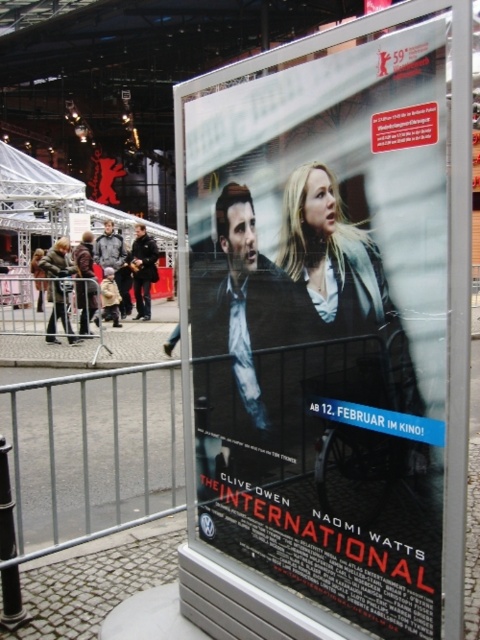
Is matte black suit at center wider than dark gray jacket at center?

No.

Is matte black suit at center to the right of dark gray jacket at center from the viewer's perspective?

Correct, you'll find matte black suit at center to the right of dark gray jacket at center.

I want to click on matte black suit at center, so click(243, 346).

Locate an element on the screen. matte black suit at center is located at coordinates (243, 346).

Does matte black suit at center have a greater width compared to dark brown leather jacket at center?

No, matte black suit at center is not wider than dark brown leather jacket at center.

Which is behind, point (276, 294) or point (129, 259)?

The point (129, 259) is more distant.

Is point (224, 260) in front of point (143, 296)?

That is True.

Locate an element on the screen. The height and width of the screenshot is (640, 480). matte black suit at center is located at coordinates (243, 346).

Can you confirm if dark brown leather jacket at center is wider than dark gray jacket at center?

In fact, dark brown leather jacket at center might be narrower than dark gray jacket at center.

Is point (144, 284) positioned after point (117, 280)?

No, (144, 284) is in front of (117, 280).

At what (x,y) coordinates should I click in order to perform the action: click on dark brown leather jacket at center. Please return your answer as a coordinate pair (x, y). Image resolution: width=480 pixels, height=640 pixels. Looking at the image, I should click on (143, 269).